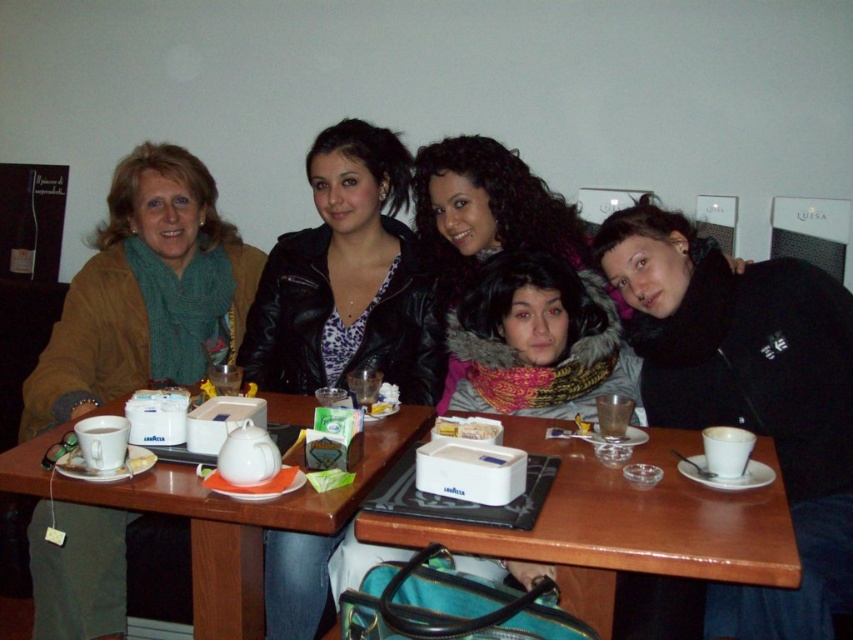
Question: Which object appears farthest from the camera in this image?

Choices:
 (A) white matte cup at table center
 (B) white matte cup at lower right
 (C) wooden table at center
 (D) green knitted scarf at left

Answer: (D)

Question: Is wooden table at center below white matte cup at lower right?

Choices:
 (A) no
 (B) yes

Answer: (B)

Question: Is leather jacket at center smaller than white glossy table at center?

Choices:
 (A) yes
 (B) no

Answer: (A)

Question: Which point appears farthest from the camera in this image?

Choices:
 (A) (755, 632)
 (B) (228, 564)
 (C) (120, 458)

Answer: (B)

Question: Which is nearer to the black fleece jacket at center?

Choices:
 (A) white matte cup at lower right
 (B) green knitted scarf at left

Answer: (A)

Question: Does black fleece jacket at center have a larger size compared to white matte cup at table center?

Choices:
 (A) yes
 (B) no

Answer: (A)